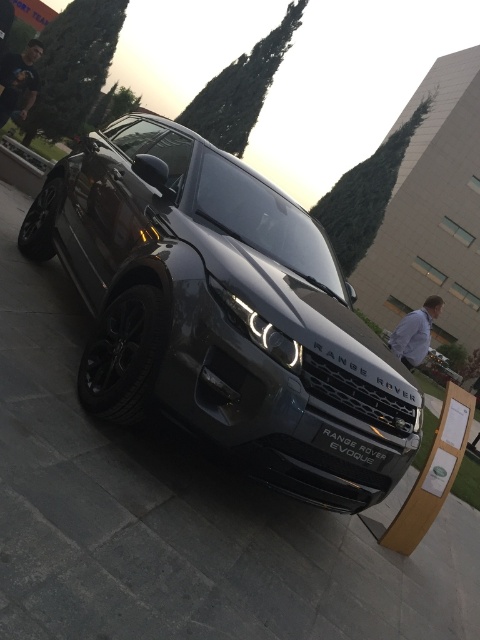
You are a photographer trying to capture both the satin black range rover evoque at center and the black matte range rover evoque at center in a single shot. Which one should you focus on first to ensure it appears sharp in the foreground?

The satin black range rover evoque at center should be focused on first because it is located above the black matte range rover evoque at center, making it closer to the camera and thus the foreground.

You are a parking attendant and need to fit both the satin metallic range rover evoque at center and the satin black range rover evoque at center into a parking spot that is 2.5 meters wide. Based on the provided information, can both vehicles fit side by none?

The satin metallic range rover evoque at center might be wider than the satin black range rover evoque at center, so it is uncertain if both can fit into the 2.5 meter wide parking spot without overlapping. Further measurements are needed to confirm.

You are a photographer trying to capture both the satin metallic Range Rover Evoque at center and the black matte Range Rover Evoque at center in a single shot. Based on their positions, which one do you need to adjust your camera angle upwards to include in the frame?

The satin metallic Range Rover Evoque at center is above the black matte Range Rover evoque at center, so you need to adjust your camera angle upwards to include the satin metallic Range Rover Evoque at center in the frame.